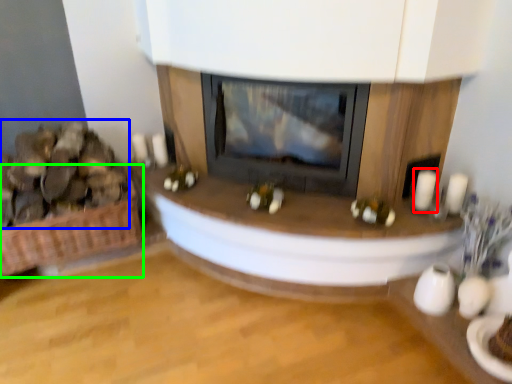
Question: Considering the real-world distances, which object is closest to candle (highlighted by a red box)? food (highlighted by a blue box) or basket (highlighted by a green box).

Choices:
 (A) food
 (B) basket

Answer: (B)